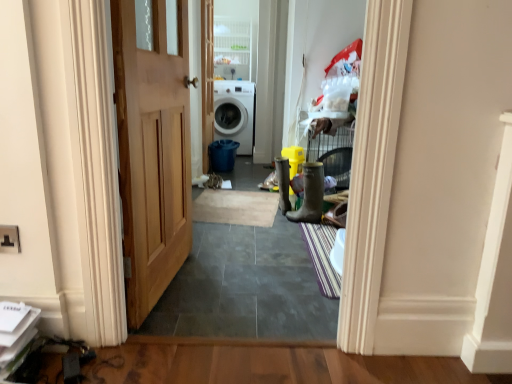
You are a GUI agent. You are given a task and a screenshot of the screen. Output one action in this format:
    pyautogui.click(x=<x>, y=<y>)
    Task: Click on the free space between rubber/matte boot at right, which is counted as the second boot, starting from the back, and wooden door at left
    This screenshot has width=512, height=384.
    Given the screenshot: What is the action you would take?
    pyautogui.click(x=234, y=258)